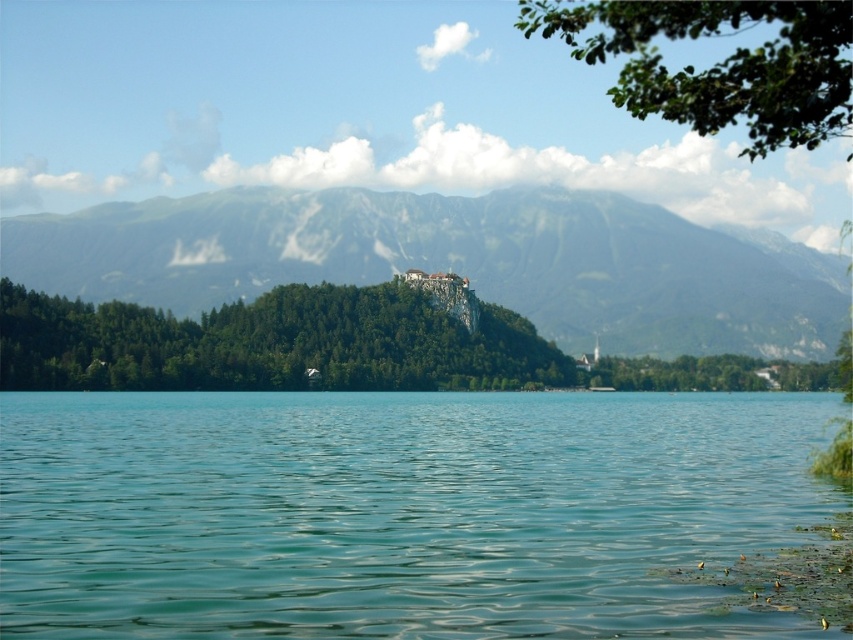
Is point (447, 636) more distant than point (695, 364)?

No, (447, 636) is closer to viewer.

Which is more to the right, clear water at center or green leafy tree at center?

green leafy tree at center is more to the right.

Between point (122, 442) and point (219, 356), which one is positioned in front?

Positioned in front is point (122, 442).

You are a GUI agent. You are given a task and a screenshot of the screen. Output one action in this format:
    pyautogui.click(x=<x>, y=<y>)
    Task: Click on the clear water at center
    
    Given the screenshot: What is the action you would take?
    pyautogui.click(x=397, y=513)

Who is more forward, (196,358) or (798,128)?

Positioned in front is point (798,128).

Consider the image. Is green leafy tree at center above green leafy branch at upper right?

No, green leafy tree at center is not above green leafy branch at upper right.

Describe the element at coordinates (311, 346) in the screenshot. The width and height of the screenshot is (853, 640). I see `green leafy tree at center` at that location.

The height and width of the screenshot is (640, 853). In order to click on green leafy tree at center in this screenshot , I will do `click(311, 346)`.

Consider the image. Measure the distance from clear water at center to green leafy branch at upper right.

clear water at center and green leafy branch at upper right are 86.81 meters apart from each other.

Can you confirm if clear water at center is smaller than green leafy branch at upper right?

Yes.

Locate an element on the screen. Image resolution: width=853 pixels, height=640 pixels. clear water at center is located at coordinates (397, 513).

This screenshot has height=640, width=853. I want to click on clear water at center, so click(397, 513).